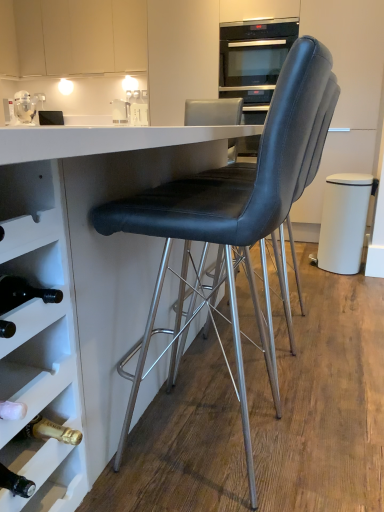
Question: From a real-world perspective, is matte white cabinet at upper left physically located above or below white matte trash can at right?

Choices:
 (A) below
 (B) above

Answer: (B)

Question: From their relative heights in the image, would you say matte white cabinet at upper left is taller or shorter than white matte trash can at right?

Choices:
 (A) short
 (B) tall

Answer: (B)

Question: Which object is the farthest from the clear glass jar at upper left?

Choices:
 (A) white matte trash can at right
 (B) black leather chair at center, which is the second chair from back to front
 (C) metallic silver kettle at upper center
 (D) black glass oven at upper center
 (E) black leather chair at center, the 2th chair in the front-to-back sequence

Answer: (B)

Question: Estimate the real-world distances between objects in this image. Which object is farther from the white glossy table at center?

Choices:
 (A) clear glass jar at upper left
 (B) metallic silver kettle at upper center
 (C) black leather chair at center, which is the second chair from back to front
 (D) black leather chair at center, the 2th chair in the front-to-back sequence
 (E) white matte trash can at right

Answer: (B)